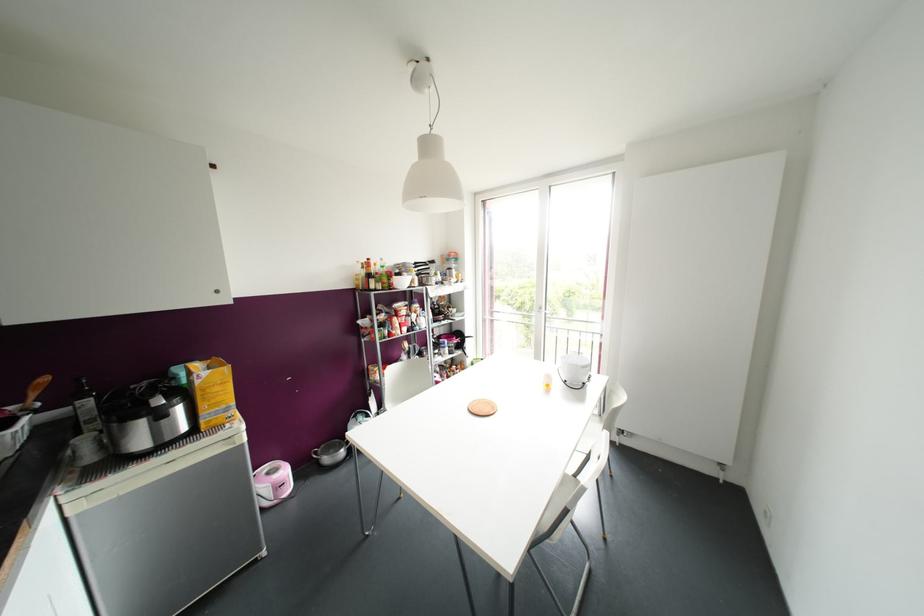
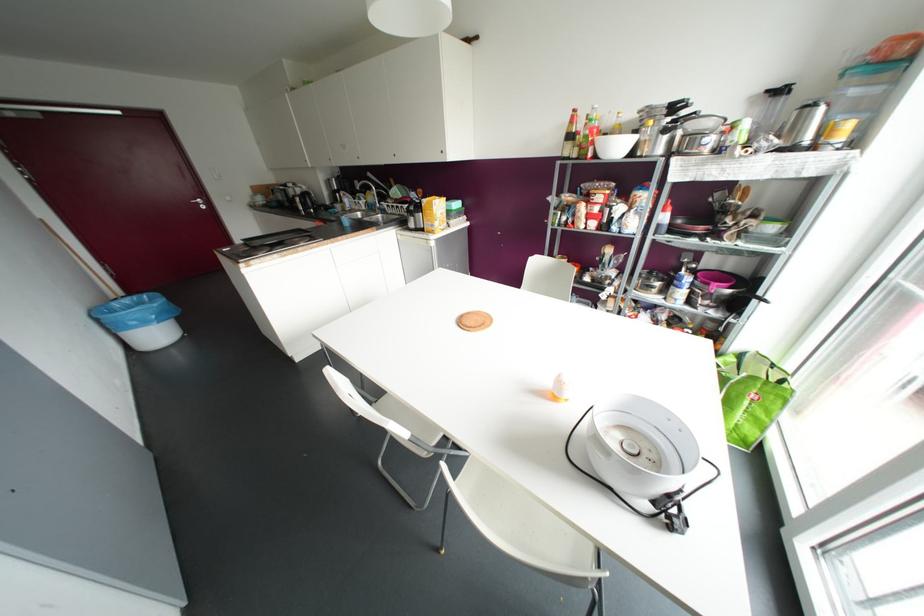
Where in the second image is the point corresponding to point 416,264 from the first image?

(673, 107)